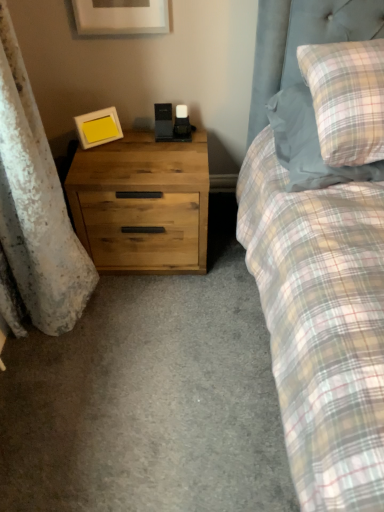
Locate an element on the screen. free space above natural wood chest of drawers at left (from a real-world perspective) is located at coordinates (152, 147).